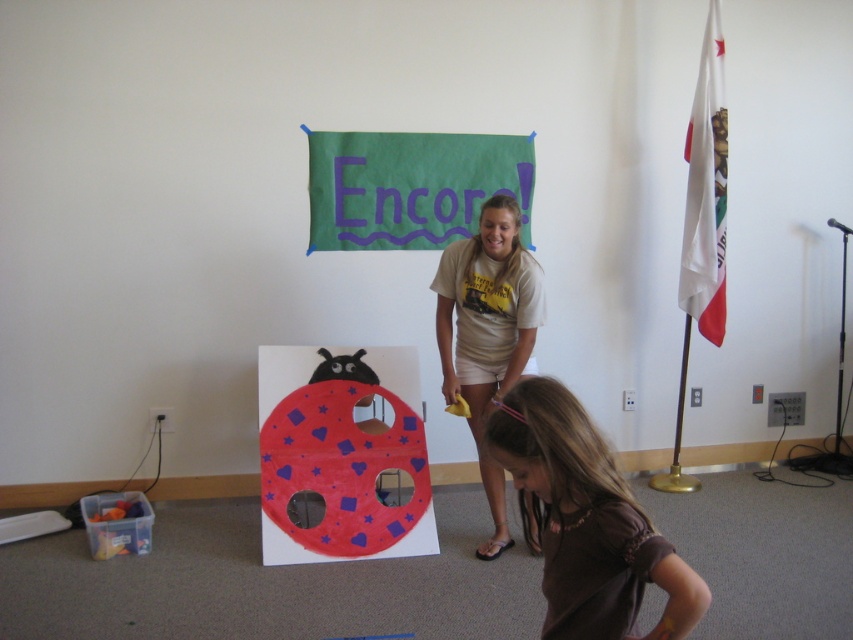
Question: Is brown cotton shirt at lower center positioned behind beige cotton t-shirt at center?

Choices:
 (A) no
 (B) yes

Answer: (A)

Question: Which of the following is the closest to the observer?

Choices:
 (A) beige cotton t-shirt at center
 (B) brown cotton shirt at lower center

Answer: (B)

Question: Observing the image, what is the correct spatial positioning of brown cotton shirt at lower center in reference to beige cotton t-shirt at center?

Choices:
 (A) below
 (B) above

Answer: (A)

Question: Is brown cotton shirt at lower center above beige cotton t-shirt at center?

Choices:
 (A) yes
 (B) no

Answer: (B)